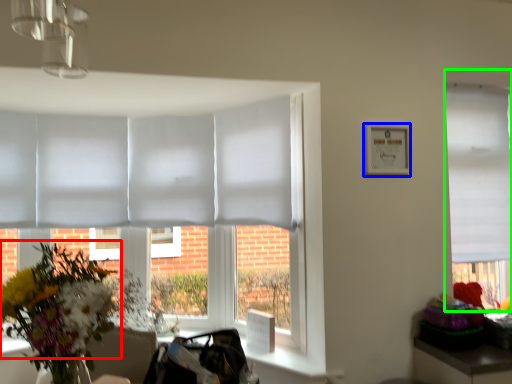
Question: Which object is positioned farthest from flower (highlighted by a red box)? Select from picture frame (highlighted by a blue box) and window (highlighted by a green box).

Choices:
 (A) picture frame
 (B) window

Answer: (B)